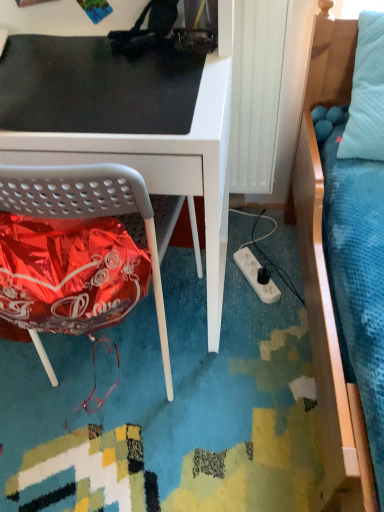
I want to click on vacant area that lies to the right of white plastic power outlet at lower center, so click(284, 276).